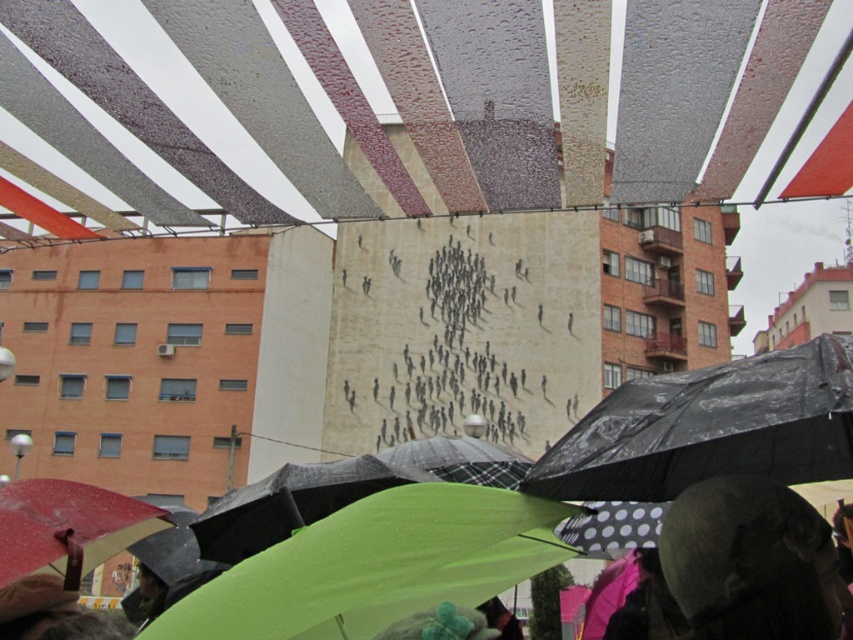
Question: Which point is closer to the camera?

Choices:
 (A) (769, 470)
 (B) (265, 564)

Answer: (B)

Question: Can you confirm if green matte umbrella at lower center is wider than dark gray wool hat at lower right?

Choices:
 (A) no
 (B) yes

Answer: (B)

Question: Which object is closer to the camera taking this photo?

Choices:
 (A) dark gray wool hat at lower right
 (B) textured fabric canopy at center
 (C) green matte umbrella at lower center
 (D) black plastic umbrella at center

Answer: (C)

Question: Is dark gray wool hat at lower right to the left of textured fabric canopy at center from the viewer's perspective?

Choices:
 (A) yes
 (B) no

Answer: (B)

Question: Can you confirm if green matte umbrella at lower center is positioned to the left of black plastic umbrella at center?

Choices:
 (A) no
 (B) yes

Answer: (B)

Question: Which point is farther from the camera taking this photo?

Choices:
 (A) (689, 577)
 (B) (431, 492)
 (C) (657, 461)

Answer: (C)